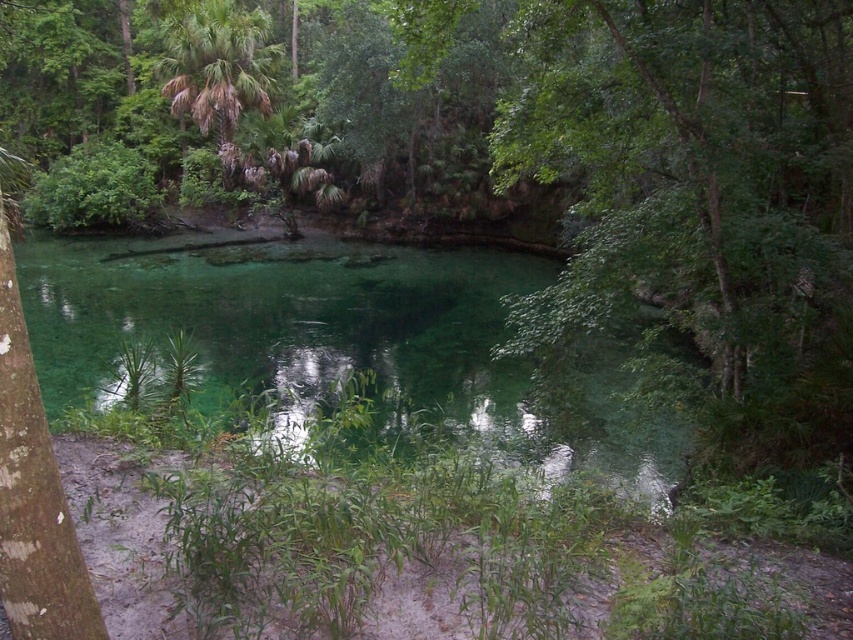
You are a photographer planning to capture the entire scene in one shot. You notice the green translucent water at center and the green leafy palm tree at upper left. Which object occupies more horizontal space in the image?

The green translucent water at center occupies more horizontal space than the green leafy palm tree at upper left because its width surpasses the palm tree.

You are standing on the shore of the serene natural scene and want to throw a small pebble into the green translucent water at center. If you can throw the pebble 5 meters, will it land in the water?

The green translucent water at center is 5.63 meters away from the shore. Since you can only throw the pebble 5 meters, it will not reach the water.

You are a photographer standing at the edge of the water. You want to capture a photo that includes both the green translucent water at center and the green leafy palm tree at upper left. Based on their positions, where should you position yourself to ensure both are in the frame?

Since the green translucent water at center is below the green leafy palm tree at upper left, you should position yourself at the edge of the water facing upward to include both the palm tree above and the water below in your frame.